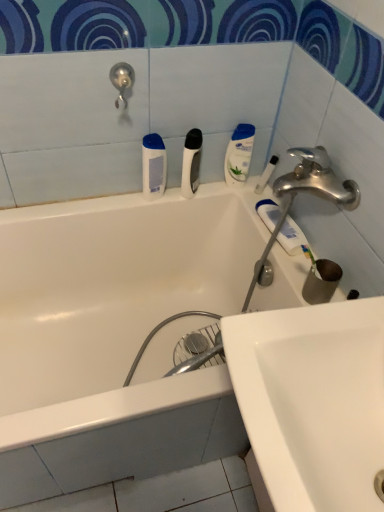
Identify the location of free space that is in between white matte toothpaste at upper right and white glossy lotion at upper right, the third toiletry from the left. The image size is (384, 512). (253, 204).